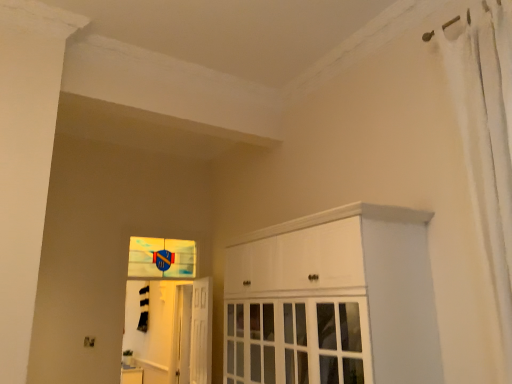
Locate an element on the screen. metallic elevator at center is located at coordinates (173, 331).

What do you see at coordinates (486, 135) in the screenshot? I see `white fabric shower curtain at right` at bounding box center [486, 135].

I want to click on white fabric shower curtain at right, so click(486, 135).

What do you see at coordinates (181, 335) in the screenshot?
I see `translucent glass screen door at lower left` at bounding box center [181, 335].

The width and height of the screenshot is (512, 384). What are the coordinates of `metallic elevator at center` in the screenshot? It's located at (173, 331).

Considering the sizes of objects white fabric shower curtain at right and blue glass window at center in the image provided, who is thinner, white fabric shower curtain at right or blue glass window at center?

blue glass window at center.

Where is `shower curtain that is above the blue glass window at center (from a real-world perspective)`? shower curtain that is above the blue glass window at center (from a real-world perspective) is located at coordinates (486, 135).

Is white fabric shower curtain at right oriented towards blue glass window at center?

No.

Which object is positioned more to the right, white fabric shower curtain at right or blue glass window at center?

white fabric shower curtain at right.

Is white fabric shower curtain at right next to metallic elevator at center and touching it?

white fabric shower curtain at right and metallic elevator at center are clearly separated.

The image size is (512, 384). I want to click on shower curtain in front of the metallic elevator at center, so click(486, 135).

Can you tell me how much white fabric shower curtain at right and metallic elevator at center differ in facing direction?

There is a 91-degree angle between the facing directions of white fabric shower curtain at right and metallic elevator at center.

Looking at this image, which object is wider, white fabric shower curtain at right or metallic elevator at center?

white fabric shower curtain at right.

Is blue glass window at center not within white glossy cabinet at center?

That's correct, blue glass window at center is outside of white glossy cabinet at center.

Is blue glass window at center positioned in front of white glossy cabinet at center?

No, it is not.

Is point (185, 270) positioned behind point (244, 274)?

Yes, point (185, 270) is farther from viewer.

The height and width of the screenshot is (384, 512). I want to click on cabinetry lying below the blue glass window at center (from the image's perspective), so click(x=333, y=300).

Consider the image. Who is shorter, metallic elevator at center or translucent glass screen door at lower left?

metallic elevator at center.

Considering the relative sizes of metallic elevator at center and translucent glass screen door at lower left in the image provided, is metallic elevator at center bigger than translucent glass screen door at lower left?

Actually, metallic elevator at center might be smaller than translucent glass screen door at lower left.

The height and width of the screenshot is (384, 512). I want to click on screen door lying below the metallic elevator at center (from the image's perspective), so click(x=181, y=335).

Between point (168, 293) and point (188, 377), which one is positioned in front?

The point (188, 377) is in front.

Is white fabric shower curtain at right smaller than white glossy cabinet at center?

Correct, white fabric shower curtain at right occupies less space than white glossy cabinet at center.

Looking at this image, can you confirm if white fabric shower curtain at right is taller than white glossy cabinet at center?

Correct, white fabric shower curtain at right is much taller as white glossy cabinet at center.

This screenshot has width=512, height=384. I want to click on shower curtain above the white glossy cabinet at center (from a real-world perspective), so click(486, 135).

Looking at this image, which object is more forward, white fabric shower curtain at right or white glossy cabinet at center?

white fabric shower curtain at right.

Who is shorter, white glossy door at center or blue glass window at center?

With less height is blue glass window at center.

Between white glossy door at center and blue glass window at center, which one has smaller width?

blue glass window at center.

In the scene shown: Considering the relative positions of white glossy door at center and blue glass window at center in the image provided, is white glossy door at center in front of blue glass window at center?

Yes, the depth of white glossy door at center is less than that of blue glass window at center.

Is white glossy door at center bigger than blue glass window at center?

Indeed, white glossy door at center has a larger size compared to blue glass window at center.

Considering the sizes of translucent glass screen door at lower left and white glossy cabinet at center in the image, is translucent glass screen door at lower left bigger or smaller than white glossy cabinet at center?

Considering their sizes, translucent glass screen door at lower left takes up less space than white glossy cabinet at center.

From a real-world perspective, between translucent glass screen door at lower left and white glossy cabinet at center, who is vertically lower?

translucent glass screen door at lower left.

Which of these two, translucent glass screen door at lower left or white glossy cabinet at center, is thinner?

Thinner between the two is translucent glass screen door at lower left.

Is point (177, 328) positioned after point (438, 352)?

Yes, point (177, 328) is behind point (438, 352).

Where is `shower curtain on the right of blue glass window at center`? The width and height of the screenshot is (512, 384). shower curtain on the right of blue glass window at center is located at coordinates (486, 135).

You are a GUI agent. You are given a task and a screenshot of the screen. Output one action in this format:
    pyautogui.click(x=<x>, y=<y>)
    Task: Click on the elevator behind the white fabric shower curtain at right
    
    Given the screenshot: What is the action you would take?
    pyautogui.click(x=173, y=331)

In the scene shown: From the image, which object appears to be farther from metallic elevator at center, white glossy door at center or white glossy cabinet at center?

white glossy cabinet at center is positioned further to the anchor metallic elevator at center.

Estimate the real-world distances between objects in this image. Which object is further from white glossy door at center, translucent glass screen door at lower left or white fabric shower curtain at right?

white fabric shower curtain at right is further to white glossy door at center.

Considering their positions, is translucent glass screen door at lower left positioned closer to white fabric shower curtain at right than blue glass window at center?

blue glass window at center.

When comparing their distances from translucent glass screen door at lower left, does blue glass window at center or white glossy door at center seem closer?

white glossy door at center is closer to translucent glass screen door at lower left.

Based on their spatial positions, is white fabric shower curtain at right or white glossy cabinet at center further from white glossy door at center?

The object further to white glossy door at center is white fabric shower curtain at right.

Based on their spatial positions, is blue glass window at center or metallic elevator at center further from white fabric shower curtain at right?

metallic elevator at center lies further to white fabric shower curtain at right than the other object.

When comparing their distances from metallic elevator at center, does white fabric shower curtain at right or translucent glass screen door at lower left seem further?

white fabric shower curtain at right.

In the scene shown: Estimate the real-world distances between objects in this image. Which object is closer to blue glass window at center, white fabric shower curtain at right or metallic elevator at center?

metallic elevator at center lies closer to blue glass window at center than the other object.

Where is `cabinetry located between white fabric shower curtain at right and white glossy door at center in the depth direction`? cabinetry located between white fabric shower curtain at right and white glossy door at center in the depth direction is located at coordinates (333, 300).

Where is `elevator between white fabric shower curtain at right and blue glass window at center in the front-back direction`? This screenshot has width=512, height=384. elevator between white fabric shower curtain at right and blue glass window at center in the front-back direction is located at coordinates (173, 331).

Where is `elevator between white glossy door at center and translucent glass screen door at lower left from front to back`? This screenshot has width=512, height=384. elevator between white glossy door at center and translucent glass screen door at lower left from front to back is located at coordinates (173, 331).

What are the coordinates of `window between white fabric shower curtain at right and translucent glass screen door at lower left from front to back` in the screenshot? It's located at (161, 258).